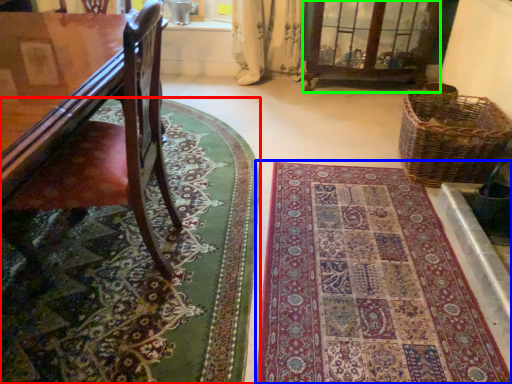
Question: Which object is the farthest from mat (highlighted by a red box)? Choose among these: mat (highlighted by a blue box) or bay window (highlighted by a green box).

Choices:
 (A) mat
 (B) bay window

Answer: (B)